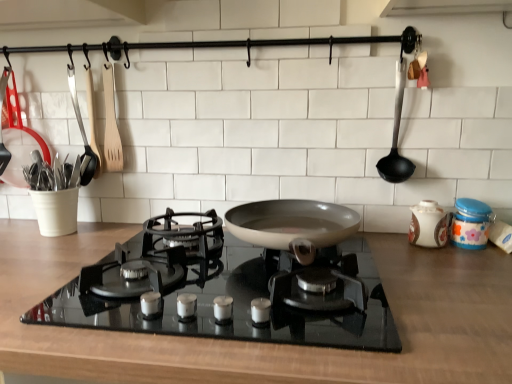
You are a GUI agent. You are given a task and a screenshot of the screen. Output one action in this format:
    pyautogui.click(x=<x>, y=<y>)
    Task: Click on the vacant area that lies in front of porcelain jar at right, the fourth kitchen appliance when ordered from left to right
    The height and width of the screenshot is (384, 512).
    Given the screenshot: What is the action you would take?
    (x=446, y=265)